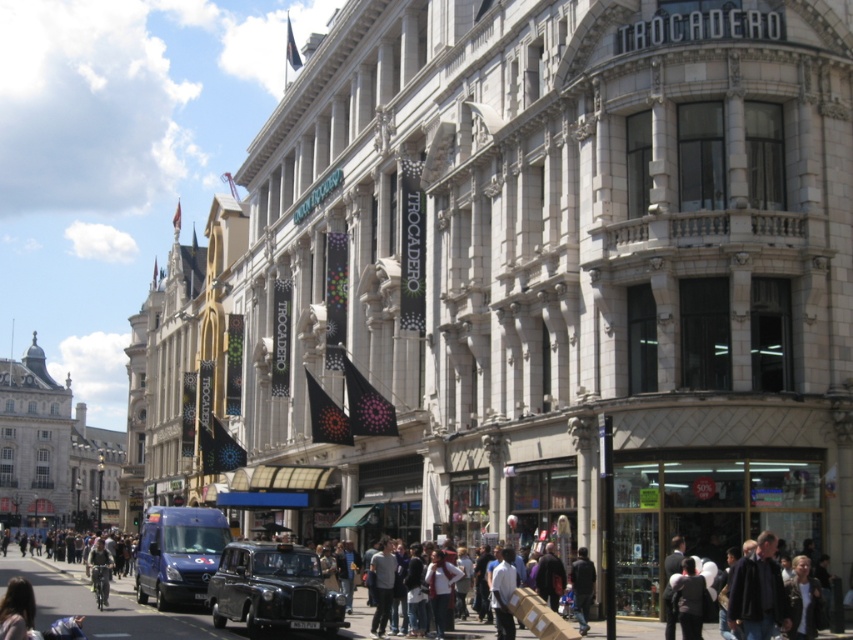
Who is more distant from viewer, [683,570] or [572,564]?

Positioned behind is point [572,564].

Can you confirm if dark gray suit at center is positioned above dark blue jacket at lower center?

Correct, dark gray suit at center is located above dark blue jacket at lower center.

Describe the element at coordinates (689, 598) in the screenshot. The height and width of the screenshot is (640, 853). I see `dark gray suit at center` at that location.

I want to click on dark gray suit at center, so click(x=689, y=598).

Is black matte taxi at center wider than light blue shirt at center?

Yes, black matte taxi at center is wider than light blue shirt at center.

Who is positioned more to the left, black matte taxi at center or light blue shirt at center?

black matte taxi at center is more to the left.

Does point (218, 576) lie in front of point (505, 576)?

No, (218, 576) is further to viewer.

At what (x,y) coordinates should I click in order to perform the action: click on black matte taxi at center. Please return your answer as a coordinate pair (x, y). Looking at the image, I should click on (271, 588).

Does blue metallic van at center-left have a greater height compared to light blue shirt at center?

Yes, blue metallic van at center-left is taller than light blue shirt at center.

Does blue metallic van at center-left have a smaller size compared to light blue shirt at center?

No.

Who is more distant from viewer, (135, 572) or (490, 600)?

The point (135, 572) is behind.

Locate an element on the screen. Image resolution: width=853 pixels, height=640 pixels. blue metallic van at center-left is located at coordinates (177, 554).